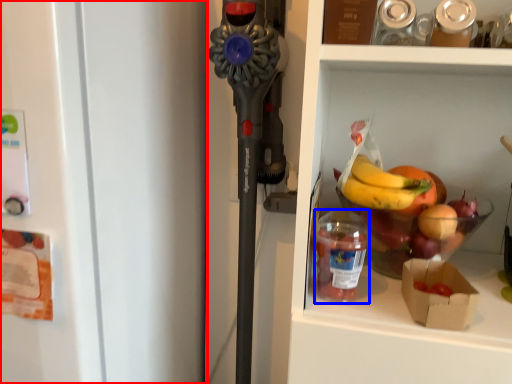
Question: Which point is closer to the camera, refrigerator (highlighted by a red box) or bottle (highlighted by a blue box)?

Choices:
 (A) refrigerator
 (B) bottle

Answer: (A)